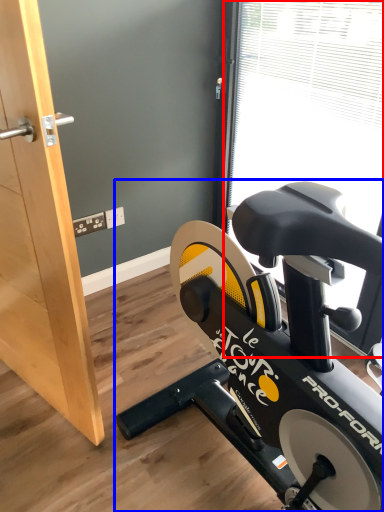
Question: Which object is closer to the camera taking this photo, window screen (highlighted by a red box) or stationary bicycle (highlighted by a blue box)?

Choices:
 (A) window screen
 (B) stationary bicycle

Answer: (B)